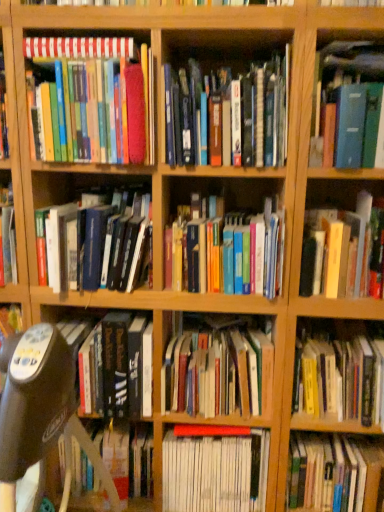
The width and height of the screenshot is (384, 512). I want to click on black plastic swivel chair at center-left, so click(x=42, y=408).

What do you see at coordinates (340, 378) in the screenshot? This screenshot has height=512, width=384. I see `yellow hardcover book at lower right, the 4th book positioned from the bottom` at bounding box center [340, 378].

I want to click on hardcover books at center, positioned as the 5th book in bottom-to-top order, so click(x=218, y=373).

Identify the location of hardcover books at center, which is counted as the 5th book, starting from the top. (227, 253).

The image size is (384, 512). Identify the location of black plastic swivel chair at center-left. pos(42,408).

Can you confirm if blue hardcover book at upper right, placed as the tenth book when sorted from bottom to top, is positioned to the left of yellow hardcover book at lower right, the ninth book from the top?

No.

Is point (333, 79) positioned in front of point (380, 383)?

That is True.

Could you tell me if blue hardcover book at upper right, which is the 3th book in top-to-bottom order, is turned towards yellow hardcover book at lower right, the 4th book positioned from the bottom?

No, blue hardcover book at upper right, which is the 3th book in top-to-bottom order, is not facing towards yellow hardcover book at lower right, the 4th book positioned from the bottom.

This screenshot has width=384, height=512. Identify the location of the 6th book below the blue hardcover book at upper right, which is the 3th book in top-to-bottom order (from the image's perspective). (340, 378).

Does point (260, 86) come closer to viewer compared to point (203, 370)?

Yes, point (260, 86) is closer to viewer.

In the scene shown: Is the position of hardcover books at center, which is counted as the first book, starting from the top, less distant than that of hardcover books at center, positioned as the 5th book in bottom-to-top order?

Yes, the depth of hardcover books at center, which is counted as the first book, starting from the top, is less than that of hardcover books at center, positioned as the 5th book in bottom-to-top order.

The image size is (384, 512). I want to click on the 7th book below the hardcover books at center, which is counted as the first book, starting from the top (from the image's perspective), so click(x=218, y=373).

Which of these two, hardcover books at center, which is counted as the first book, starting from the top, or hardcover books at center, the 8th book viewed from the top, is bigger?

hardcover books at center, which is counted as the first book, starting from the top.

Is hardcover book at right, acting as the 6th book starting from the top, positioned with its back to hardcover books at center, which is counted as the 5th book, starting from the top?

No, hardcover book at right, acting as the 6th book starting from the top, is not facing the opposite direction of hardcover books at center, which is counted as the 5th book, starting from the top.

Is hardcover book at right, acting as the 6th book starting from the top, not close to hardcover books at center, which is counted as the 5th book, starting from the top?

No.

From the image's perspective, is hardcover book at center, which is counted as the 3th book, starting from the bottom, on top of yellow hardcover book at lower right, the ninth book from the top?

Actually, hardcover book at center, which is counted as the 3th book, starting from the bottom, appears below yellow hardcover book at lower right, the ninth book from the top, in the image.

Which of these two, hardcover book at center, the tenth book positioned from the top, or yellow hardcover book at lower right, the ninth book from the top, stands taller?

Standing taller between the two is hardcover book at center, the tenth book positioned from the top.

In terms of size, does hardcover book at center, the tenth book positioned from the top, appear bigger or smaller than yellow hardcover book at lower right, the 4th book positioned from the bottom?

Considering their sizes, hardcover book at center, the tenth book positioned from the top, takes up more space than yellow hardcover book at lower right, the 4th book positioned from the bottom.

Is hardcover book at center, which is counted as the 3th book, starting from the bottom, facing away from yellow hardcover book at lower right, the ninth book from the top?

hardcover book at center, which is counted as the 3th book, starting from the bottom, does not have its back to yellow hardcover book at lower right, the ninth book from the top.

How much distance is there between matte hardcover books at upper left, marked as the second book in a top-to-bottom arrangement, and black plastic swivel chair at center-left?

matte hardcover books at upper left, marked as the second book in a top-to-bottom arrangement, is 67.42 centimeters away from black plastic swivel chair at center-left.

Looking at the image, does matte hardcover books at upper left, marked as the second book in a top-to-bottom arrangement, seem bigger or smaller compared to black plastic swivel chair at center-left?

matte hardcover books at upper left, marked as the second book in a top-to-bottom arrangement, is smaller than black plastic swivel chair at center-left.

From the image's perspective, does matte hardcover books at upper left, the 11th book when ordered from bottom to top, appear higher than black plastic swivel chair at center-left?

Yes, from the image's perspective, matte hardcover books at upper left, the 11th book when ordered from bottom to top, is above black plastic swivel chair at center-left.

Which of these two, matte hardcover books at upper left, the 11th book when ordered from bottom to top, or black plastic swivel chair at center-left, stands taller?

With more height is black plastic swivel chair at center-left.

Is hardcover book at left, the fourth book when ordered from top to bottom, bigger than hardcover book at center, the 7th book in the top-to-bottom sequence?

No.

Based on the photo, how different are the orientations of hardcover book at left, the fourth book when ordered from top to bottom, and hardcover book at center, the sixth book ordered from the bottom, in degrees?

The angular difference between hardcover book at left, the fourth book when ordered from top to bottom, and hardcover book at center, the sixth book ordered from the bottom, is 0.000195 degrees.

Would you consider hardcover book at left, the fourth book when ordered from top to bottom, to be distant from hardcover book at center, the 7th book in the top-to-bottom sequence?

No, hardcover book at left, the fourth book when ordered from top to bottom, is not far from hardcover book at center, the 7th book in the top-to-bottom sequence.

Looking at this image, is the position of hardcover book at left, the fourth book when ordered from top to bottom, more distant than that of hardcover book at center, the 7th book in the top-to-bottom sequence?

No, hardcover book at left, the fourth book when ordered from top to bottom, is closer to the viewer.

Considering the positions of point (193, 265) and point (377, 263), is point (193, 265) closer or farther from the camera than point (377, 263)?

Point (193, 265) is positioned closer to the camera compared to point (377, 263).

From the image's perspective, is hardcover books at center, which is counted as the 5th book, starting from the top, under hardcover book at right, acting as the 6th book starting from the top?

No, from the image's perspective, hardcover books at center, which is counted as the 5th book, starting from the top, is not below hardcover book at right, acting as the 6th book starting from the top.

Considering the relative sizes of hardcover books at center, the eighth book from the bottom, and hardcover book at right, acting as the 6th book starting from the top, in the image provided, is hardcover books at center, the eighth book from the bottom, taller than hardcover book at right, acting as the 6th book starting from the top,?

Correct, hardcover books at center, the eighth book from the bottom, is much taller as hardcover book at right, acting as the 6th book starting from the top.

Where is `book that is the 7th one below the blue hardcover book at upper right, placed as the tenth book when sorted from bottom to top (from a real-world perspective)`? The width and height of the screenshot is (384, 512). book that is the 7th one below the blue hardcover book at upper right, placed as the tenth book when sorted from bottom to top (from a real-world perspective) is located at coordinates (340, 378).

From the image's perspective, starting from the hardcover books at center, positioned as the 5th book in bottom-to-top order, which book is the 7th one above? Please provide its 2D coordinates.

[(228, 114)]

Which object lies further to the anchor point black plastic swivel chair at center-left, hardcover books at center, the 8th book viewed from the top, or hardcover book at center, placed as the 12th book when sorted from top to bottom?

Among the two, hardcover book at center, placed as the 12th book when sorted from top to bottom, is located further to black plastic swivel chair at center-left.

From the image, which object appears to be farther from hardcover book at center, placed as the 12th book when sorted from top to bottom, hardcover book at left, the fourth book when ordered from top to bottom, or yellow hardcover book at lower right, the ninth book from the top?

hardcover book at left, the fourth book when ordered from top to bottom, is further to hardcover book at center, placed as the 12th book when sorted from top to bottom.

When comparing their distances from hardcover book at left, the fourth book when ordered from top to bottom, does hardcover book at center, the sixth book ordered from the bottom, or hardcover books at center, the eighth book from the bottom, seem further?

hardcover book at center, the sixth book ordered from the bottom, is further to hardcover book at left, the fourth book when ordered from top to bottom.

When comparing their distances from hardcover book at right, which is the 7th book from bottom to top, does hardcover books at center, which is counted as the first book, starting from the top, or hardcover book at center, which appears as the first book when ordered from the bottom, seem further?

hardcover book at center, which appears as the first book when ordered from the bottom, is further to hardcover book at right, which is the 7th book from bottom to top.

Based on their spatial positions, is hardcover book at center, the sixth book ordered from the bottom, or hardcover books at center, which is counted as the first book, starting from the top, closer to hardcover book at center, which is counted as the 3th book, starting from the bottom?

Among the two, hardcover book at center, the sixth book ordered from the bottom, is located nearer to hardcover book at center, which is counted as the 3th book, starting from the bottom.

Based on their spatial positions, is black plastic swivel chair at center-left or hardcover book at center, which appears as the first book when ordered from the bottom, closer to hardcover books at center, the eighth book from the bottom?

The object closer to hardcover books at center, the eighth book from the bottom, is black plastic swivel chair at center-left.

Looking at the image, which one is located closer to hardcover book at center, marked as the second book in a bottom-to-top arrangement, black plastic swivel chair at center-left or blue hardcover book at upper right, placed as the tenth book when sorted from bottom to top?

black plastic swivel chair at center-left lies closer to hardcover book at center, marked as the second book in a bottom-to-top arrangement, than the other object.

Based on their spatial positions, is matte hardcover books at upper left, marked as the second book in a top-to-bottom arrangement, or hardcover book at right, which is the 7th book from bottom to top, further from blue hardcover book at upper right, placed as the tenth book when sorted from bottom to top?

matte hardcover books at upper left, marked as the second book in a top-to-bottom arrangement, is further to blue hardcover book at upper right, placed as the tenth book when sorted from bottom to top.

Locate an element on the screen. The width and height of the screenshot is (384, 512). swivel chair between blue hardcover book at upper right, which is the 3th book in top-to-bottom order, and hardcover book at center, which is counted as the 3th book, starting from the bottom, vertically is located at coordinates (42, 408).

What are the coordinates of `swivel chair between hardcover books at center, which is the twelfth book from bottom to top, and hardcover book at center, which is counted as the 3th book, starting from the bottom, vertically` in the screenshot? It's located at (42, 408).

You are a GUI agent. You are given a task and a screenshot of the screen. Output one action in this format:
    pyautogui.click(x=<x>, y=<y>)
    Task: Click on the swivel chair between matte hardcover books at upper left, marked as the second book in a top-to-bottom arrangement, and hardcover book at center, which is counted as the 3th book, starting from the bottom, vertically
    The width and height of the screenshot is (384, 512).
    Given the screenshot: What is the action you would take?
    pyautogui.click(x=42, y=408)

This screenshot has height=512, width=384. Find the location of `swivel chair between hardcover books at center, which is the twelfth book from bottom to top, and hardcover book at center, marked as the second book in a bottom-to-top arrangement, in the up-down direction`. swivel chair between hardcover books at center, which is the twelfth book from bottom to top, and hardcover book at center, marked as the second book in a bottom-to-top arrangement, in the up-down direction is located at coordinates (42, 408).